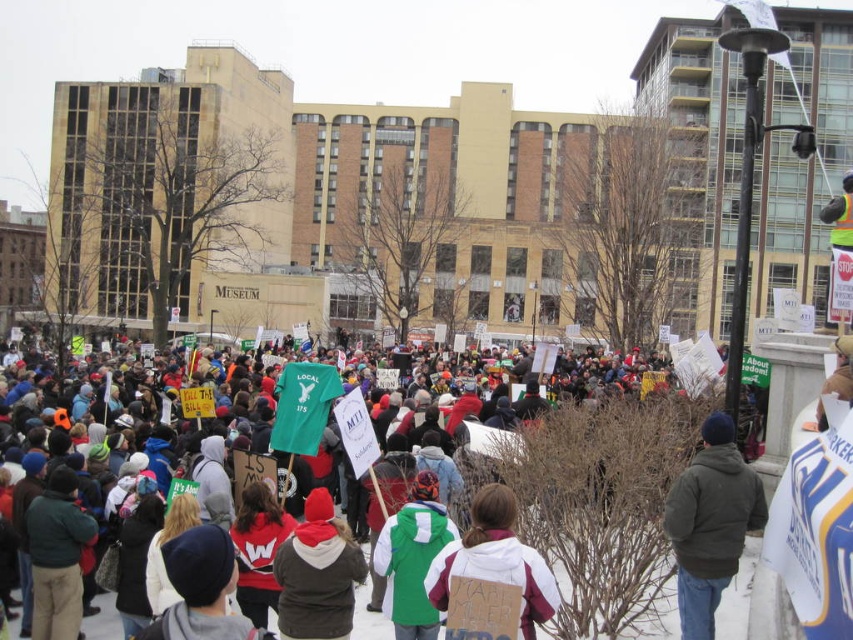
Question: Which point is farther to the camera?

Choices:
 (A) green fleece jacket at center
 (B) white fleece jacket at center
 (C) red knit cap at center
 (D) dark green jacket at lower right

Answer: (A)

Question: Based on their relative distances, which object is nearer to the dark green jacket at lower right?

Choices:
 (A) red knit cap at center
 (B) multicolored fabric crowd at center

Answer: (A)

Question: Can you confirm if dark green jacket at lower right is positioned to the right of red knit cap at center?

Choices:
 (A) no
 (B) yes

Answer: (B)

Question: Can you confirm if white fleece jacket at center is positioned to the left of green fleece jacket at center?

Choices:
 (A) yes
 (B) no

Answer: (B)

Question: Which point is farther from the camera taking this photo?

Choices:
 (A) (537, 602)
 (B) (335, 580)

Answer: (B)

Question: Does red knit cap at center appear under white fleece jacket at center?

Choices:
 (A) no
 (B) yes

Answer: (B)